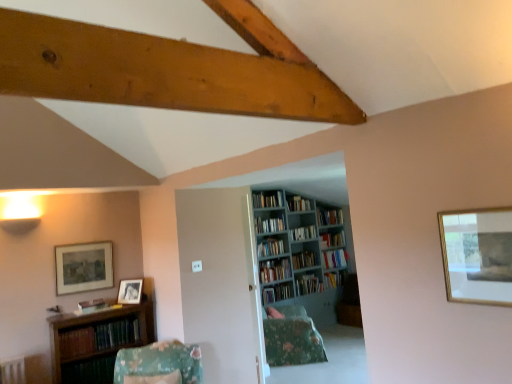
You are a GUI agent. You are given a task and a screenshot of the screen. Output one action in this format:
    pyautogui.click(x=<x>, y=<y>)
    Task: Click on the vacant space situated above hardcover book at lower left, the 1th book positioned from the front (from a real-world perspective)
    The height and width of the screenshot is (384, 512).
    Given the screenshot: What is the action you would take?
    pyautogui.click(x=91, y=358)